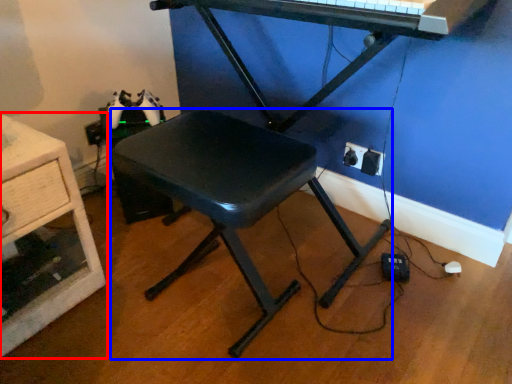
Question: Which point is closer to the camera, furniture (highlighted by a red box) or stool (highlighted by a blue box)?

Choices:
 (A) furniture
 (B) stool

Answer: (B)